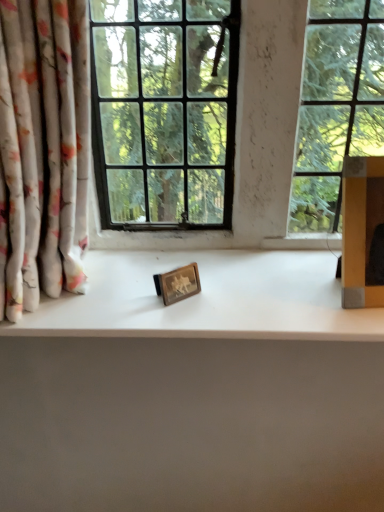
Question: Can you confirm if yellow cardboard box at right is thinner than white matte counter top at center?

Choices:
 (A) yes
 (B) no

Answer: (A)

Question: Are yellow cardboard box at right and white matte counter top at center located far from each other?

Choices:
 (A) yes
 (B) no

Answer: (B)

Question: Is the depth of yellow cardboard box at right greater than that of white matte counter top at center?

Choices:
 (A) no
 (B) yes

Answer: (A)

Question: From the image's perspective, does yellow cardboard box at right appear lower than white matte counter top at center?

Choices:
 (A) yes
 (B) no

Answer: (B)

Question: Is white matte counter top at center located within yellow cardboard box at right?

Choices:
 (A) no
 (B) yes

Answer: (A)

Question: Is yellow cardboard box at right outside white matte counter top at center?

Choices:
 (A) no
 (B) yes

Answer: (B)

Question: From a real-world perspective, does yellow cardboard box at right sit lower than floral fabric curtain at left?

Choices:
 (A) yes
 (B) no

Answer: (A)

Question: Is yellow cardboard box at right shorter than floral fabric curtain at left?

Choices:
 (A) no
 (B) yes

Answer: (B)

Question: Is yellow cardboard box at right to the right of floral fabric curtain at left from the viewer's perspective?

Choices:
 (A) no
 (B) yes

Answer: (B)

Question: Is the position of yellow cardboard box at right less distant than that of floral fabric curtain at left?

Choices:
 (A) yes
 (B) no

Answer: (B)

Question: Could you tell me if yellow cardboard box at right is facing floral fabric curtain at left?

Choices:
 (A) no
 (B) yes

Answer: (A)

Question: Does yellow cardboard box at right have a greater height compared to floral fabric curtain at left?

Choices:
 (A) no
 (B) yes

Answer: (A)

Question: Does white matte counter top at center turn towards floral fabric curtain at left?

Choices:
 (A) yes
 (B) no

Answer: (B)